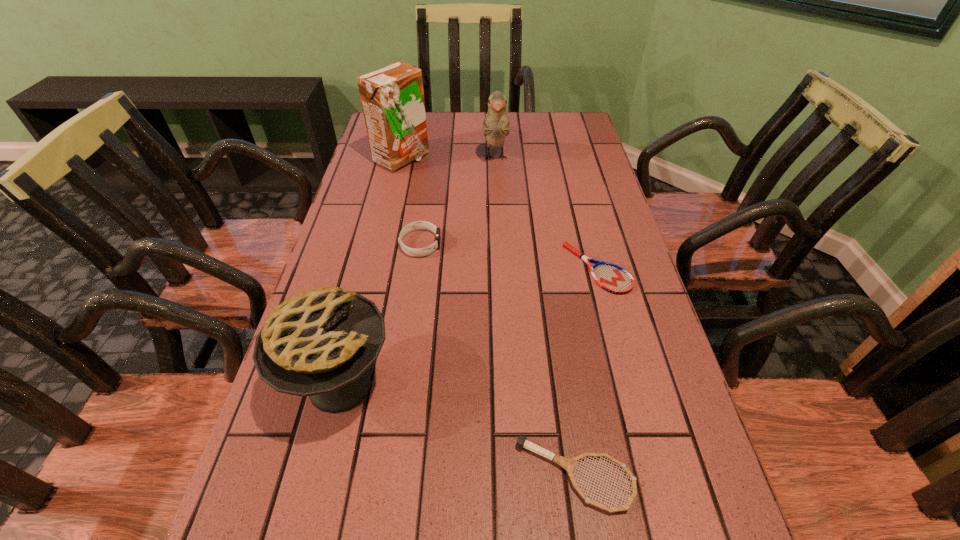
Find the location of a particular element. The width and height of the screenshot is (960, 540). free location located 0.090m on the cut side of the third tallest object is located at coordinates (445, 384).

Identify the location of free location located 0.260m on the outer surface of the wristband. This screenshot has height=540, width=960. (545, 244).

Identify the location of free location located on the back of the taller tennis racket. (557, 350).

The image size is (960, 540). I want to click on free region located 0.340m on the front of the shorter tennis racket, so click(x=644, y=446).

This screenshot has width=960, height=540. What are the coordinates of `carton present at the far edge` in the screenshot? It's located at (392, 97).

This screenshot has width=960, height=540. Find the location of `bird at the far edge`. bird at the far edge is located at coordinates (496, 126).

At what (x,y) coordinates should I click in order to perform the action: click on carton that is at the left edge. Please return your answer as a coordinate pair (x, y). Looking at the image, I should click on (392, 97).

The image size is (960, 540). What are the coordinates of `pie positioned at the left edge` in the screenshot? It's located at (319, 343).

Find the location of a particular element. This screenshot has height=540, width=960. object present at the far left corner is located at coordinates (392, 97).

You are a GUI agent. You are given a task and a screenshot of the screen. Output one action in this format:
    pyautogui.click(x=<x>, y=<y>)
    Task: Click on the vacant space at the left edge of the desktop
    The image size is (960, 540).
    Given the screenshot: What is the action you would take?
    pyautogui.click(x=349, y=213)